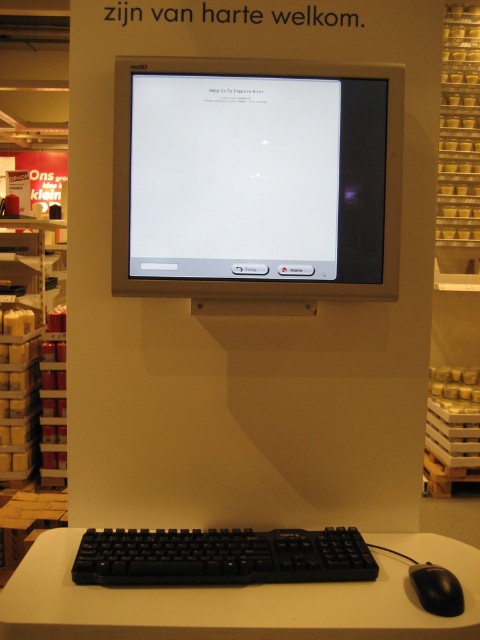
You are setting up a new computer workstation and need to place both the white plastic table at center and the black plastic keyboard at lower center. Given their sizes, which object should you place first to ensure proper positioning?

The white plastic table at center is larger in size than the black plastic keyboard at lower center, so you should place the white plastic table at center first to accommodate the keyboard later.

Looking at this image, you are a technician trying to fix an error on the CRT monitor. You notice two points on the screen at coordinates point (17, 568) and point (166, 561). Which point is closer to the bottom edge of the monitor screen?

Point (17, 568) is behind point (166, 561), so it is closer to the bottom edge of the monitor screen.